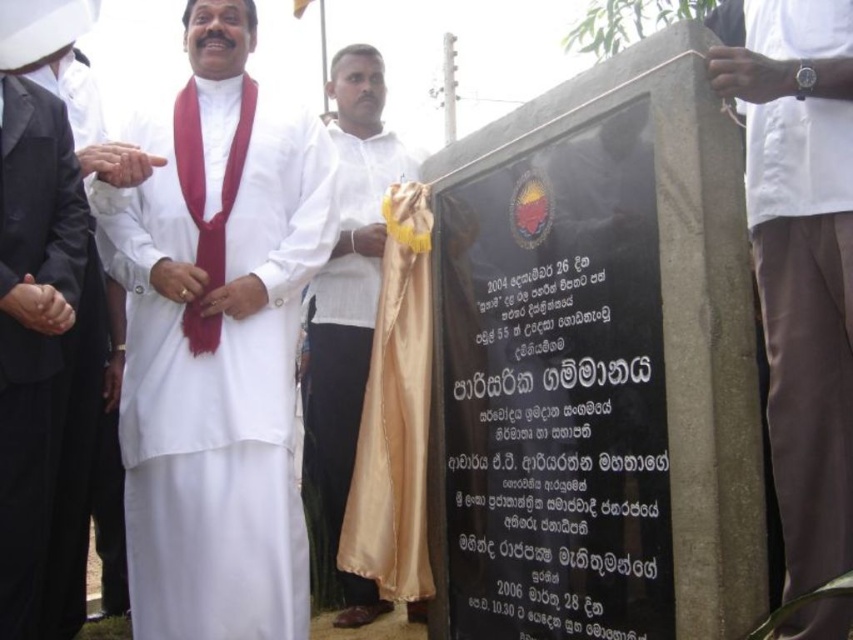
You are attending the event and want to take a photo of the central figure. To ensure both the black satin robe at left and the silky red tie at left are clearly visible in the frame, which one should you focus on first?

You should focus on the black satin robe at left first because it is closer to the viewer than the silky red tie at left, so focusing on it will ensure both are in focus through depth of field.

You are a photographer standing at the back of the event venue. You need to capture a photo of the black satin robe at left and the white satin cloth at center. The camera you are using has a maximum focus range of 15 feet. Can you take a photo of both objects in focus without moving closer?

The black satin robe at left is 16.90 feet away from the white satin cloth at center. Since the camera has a maximum focus range of 15 feet, the distance between them exceeds this limit. Therefore, you cannot take a photo of both objects in focus without moving closer.